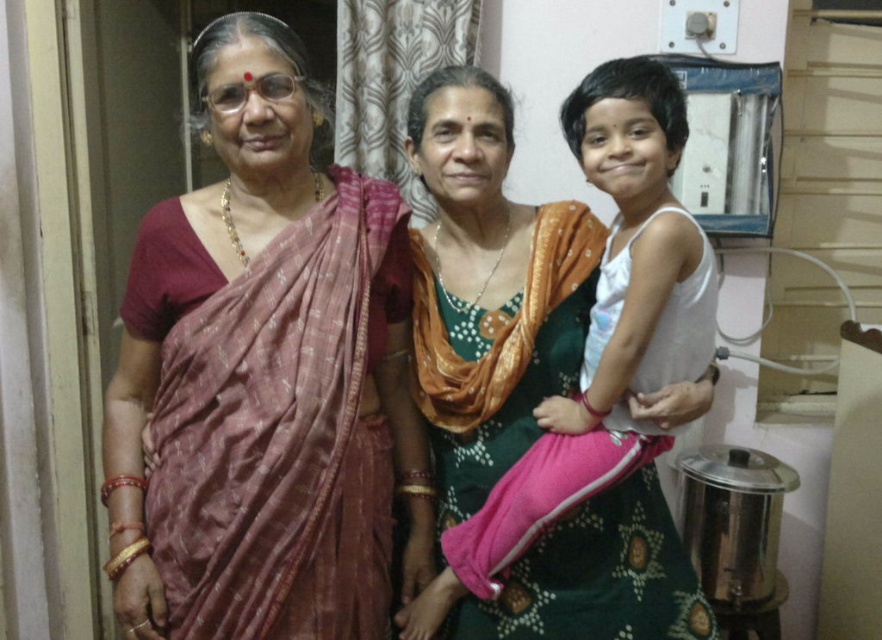
You are a photographer trying to capture a clear photo of both the matte pink sari at center and the green silk sari at center. Which one will appear larger in the photo?

The matte pink sari at center will appear larger in the photo because it is closer to the viewer than the green silk sari at center.